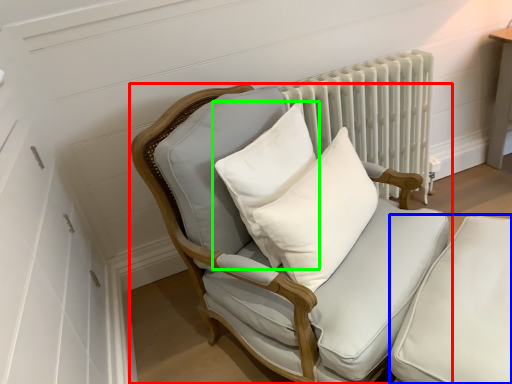
Question: Estimate the real-world distances between objects in this image. Which object is closer to chair (highlighted by a red box), swivel chair (highlighted by a blue box) or pillow (highlighted by a green box)?

Choices:
 (A) swivel chair
 (B) pillow

Answer: (B)